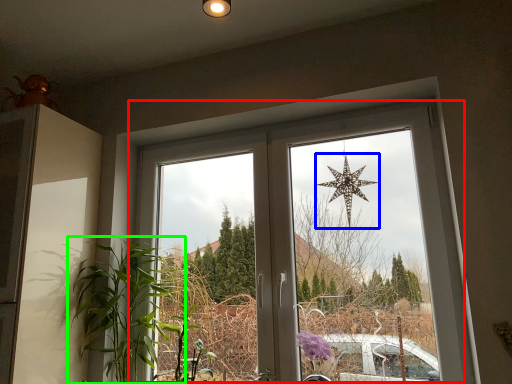
Question: Which is farther away from window (highlighted by a red box)? star (highlighted by a blue box) or houseplant (highlighted by a green box)?

Choices:
 (A) star
 (B) houseplant

Answer: (B)